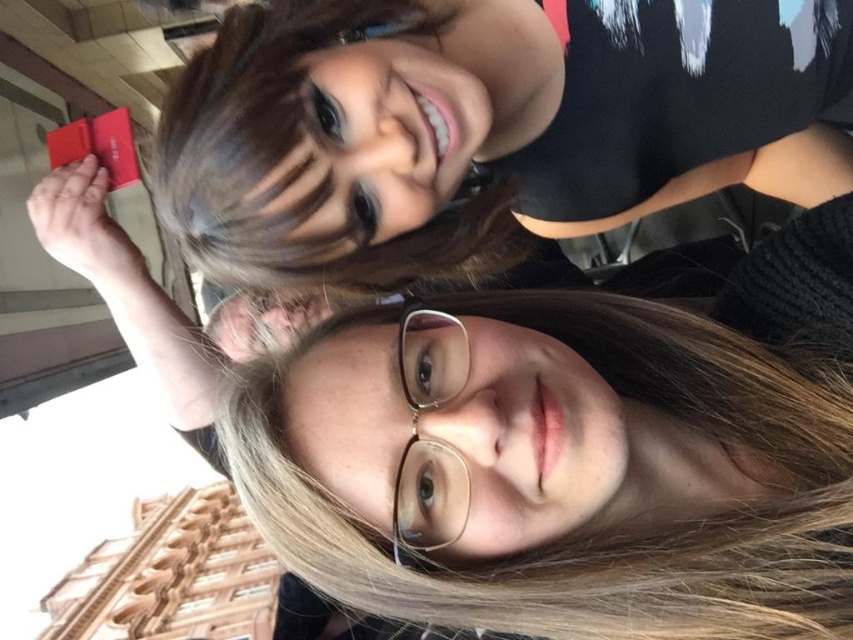
What do you see at coordinates (328, 154) in the screenshot?
I see `brown shiny hair at upper center` at bounding box center [328, 154].

Who is more forward, (289, 266) or (428, 381)?

Point (428, 381) is more forward.

The height and width of the screenshot is (640, 853). Describe the element at coordinates (328, 154) in the screenshot. I see `brown shiny hair at upper center` at that location.

Where is `brown shiny hair at upper center`? This screenshot has height=640, width=853. brown shiny hair at upper center is located at coordinates (328, 154).

Which is more to the left, matte black hair at upper center or brown shiny hair at upper center?

brown shiny hair at upper center

Is point (519, 417) in front of point (397, 257)?

That is True.

Is point (616, 625) farther from viewer compared to point (318, 202)?

No, it is not.

I want to click on matte black hair at upper center, so click(x=532, y=440).

Is matte black hair at upper center to the right of gold metallic glasses at center from the viewer's perspective?

Indeed, matte black hair at upper center is positioned on the right side of gold metallic glasses at center.

Describe the element at coordinates (532, 440) in the screenshot. I see `matte black hair at upper center` at that location.

Is point (769, 314) positioned after point (424, 364)?

Yes.

Locate an element on the screen. The height and width of the screenshot is (640, 853). matte black hair at upper center is located at coordinates (532, 440).